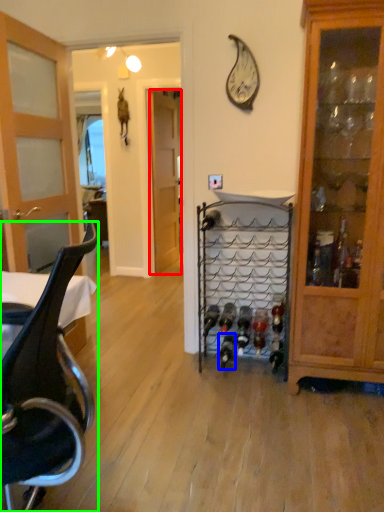
Question: Considering the real-world distances, which object is closest to door (highlighted by a red box)? wine bottle (highlighted by a blue box) or chair (highlighted by a green box).

Choices:
 (A) wine bottle
 (B) chair

Answer: (A)